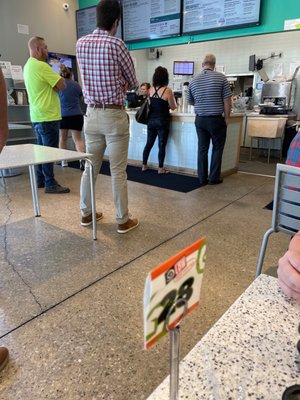
Locate an element on the screen. floor is located at coordinates (171, 226).